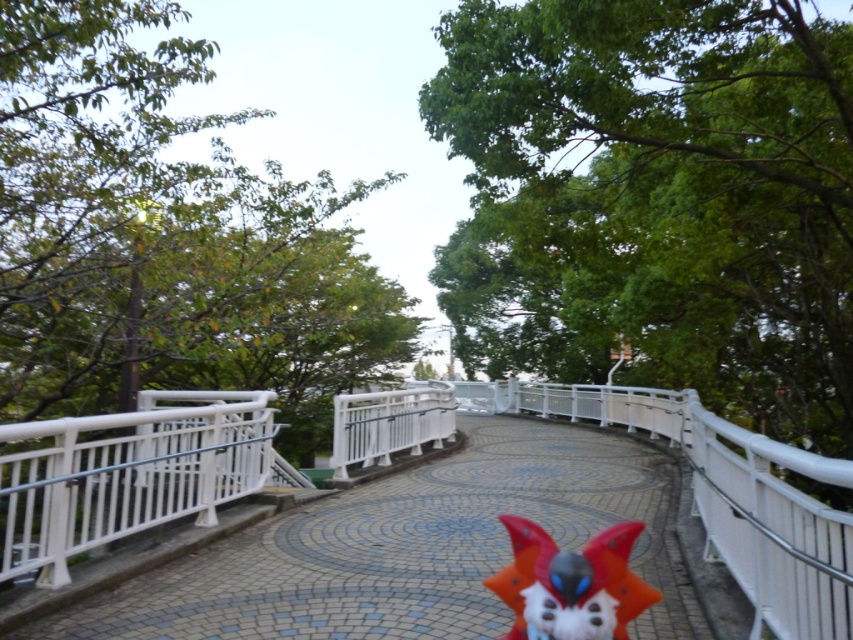
You are a delivery robot with a width of 1.2 meters. You need to move from the starting point to the end point along the walkway. The path must go around the shiny red plush toy at center and the white glossy bridge at center. Can you pass through the space between them without getting stuck?

The distance between the white glossy bridge at center and the shiny red plush toy at center is 3.35 meters. Since the robot is 1.2 meters wide, there is enough space for it to pass through the gap between them safely.

You are standing at the starting point of the walkway and want to reach the white glossy bridge at center. According to the scene description, in which direction should you head relative to the walkway?

The white glossy bridge at center is located at the center of the scene, so you should head towards the center of the walkway to reach it.

You are standing on the curved pedestrian walkway bordered by white railings and want to take a photo of both the point at coordinates point (630, 506) and point (563, 634). Which point is closer to your camera lens?

Point (563, 634) is closer to the camera lens because the description states that point (630, 506) is further to the camera than point (563, 634).